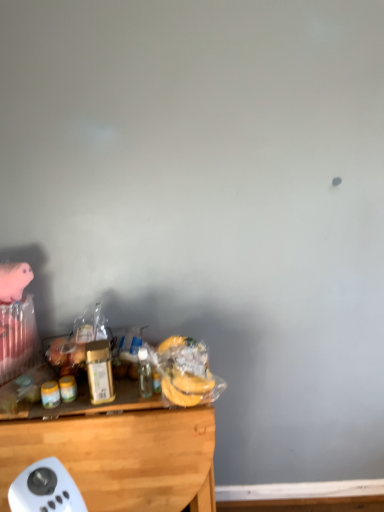
Identify the location of free space between translucent plastic bananas at lower center, acting as the first food starting from the right, and metallic gold canister at center, the first bottle positioned from the left. (133, 400).